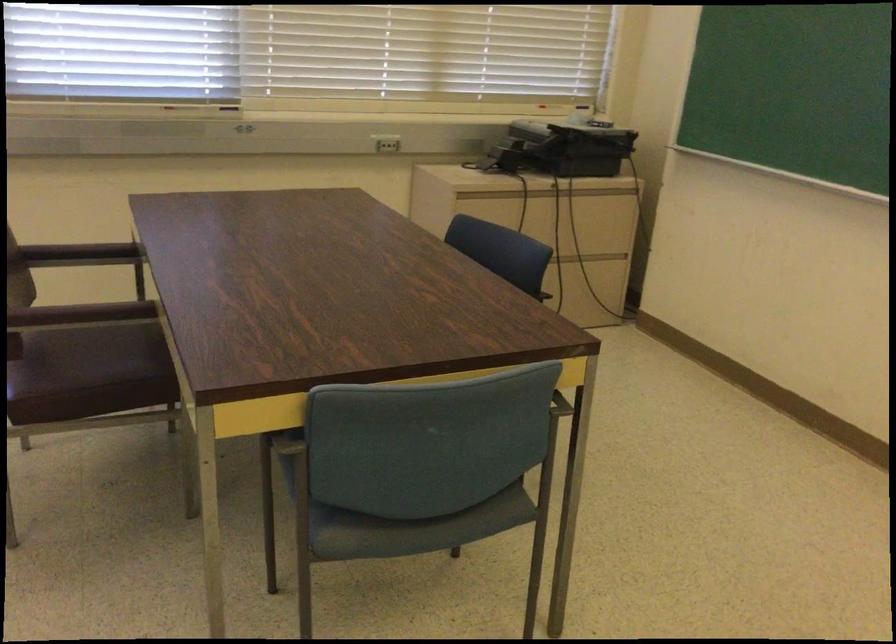
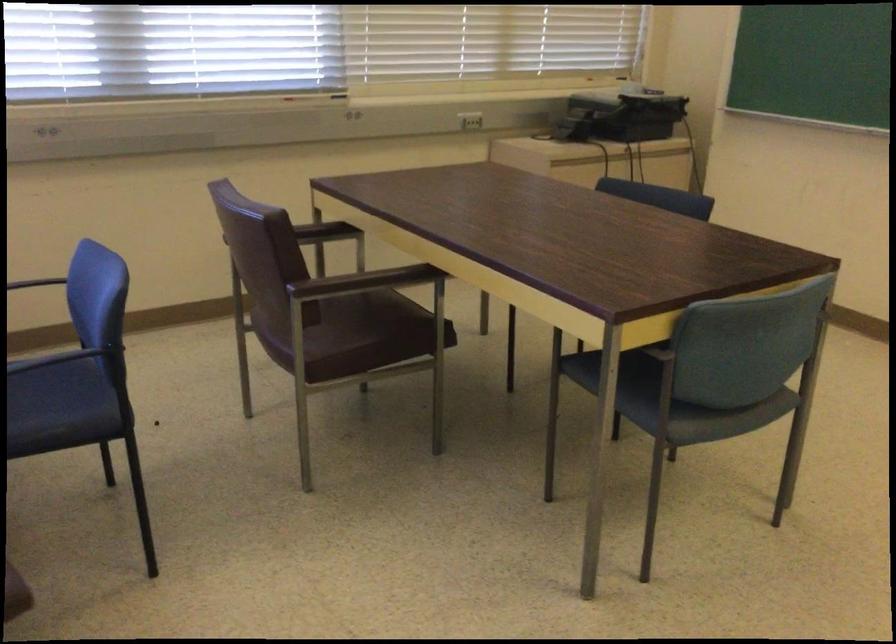
The point at (314, 475) is marked in the first image. Where is the corresponding point in the second image?

(625, 384)